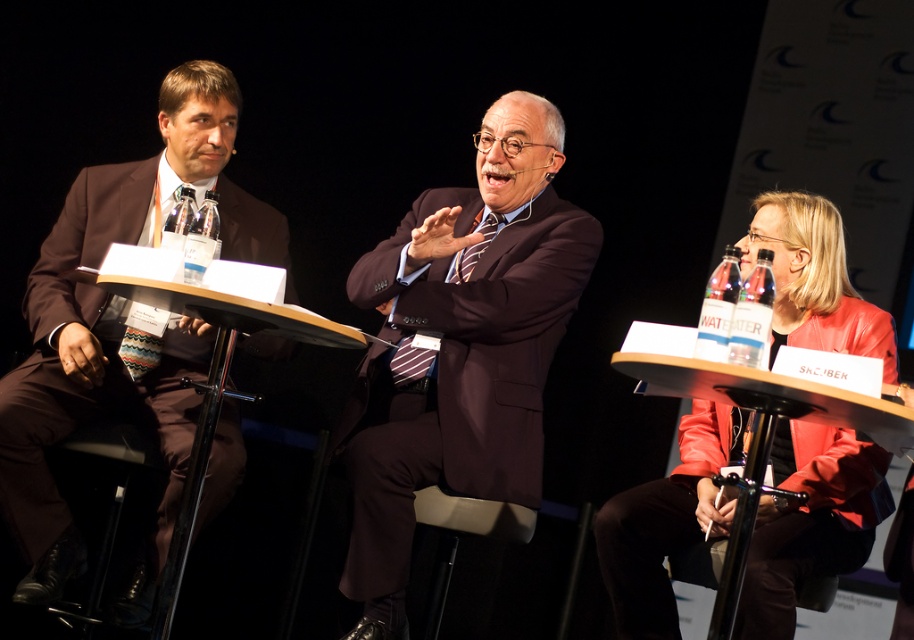
Can you confirm if dark brown suit at center is smaller than brown suit at left?

Yes.

Looking at this image, can you confirm if dark brown suit at center is positioned below brown suit at left?

Yes.

Is point (537, 115) positioned in front of point (101, 173)?

Yes.

This screenshot has width=914, height=640. I want to click on dark brown suit at center, so click(x=459, y=348).

Consider the image. Can you confirm if brown suit at left is positioned to the right of wooden table at left?

Incorrect, brown suit at left is not on the right side of wooden table at left.

What do you see at coordinates (120, 330) in the screenshot? The width and height of the screenshot is (914, 640). I see `brown suit at left` at bounding box center [120, 330].

Where is `brown suit at left`? This screenshot has width=914, height=640. brown suit at left is located at coordinates (120, 330).

Who is higher up, dark brown suit at center or wooden table at left?

dark brown suit at center is above.

Between dark brown suit at center and wooden table at left, which one has more height?

With more height is dark brown suit at center.

Image resolution: width=914 pixels, height=640 pixels. Find the location of `dark brown suit at center`. dark brown suit at center is located at coordinates (459, 348).

At what (x,y) coordinates should I click in order to perform the action: click on dark brown suit at center. Please return your answer as a coordinate pair (x, y). The width and height of the screenshot is (914, 640). Looking at the image, I should click on (459, 348).